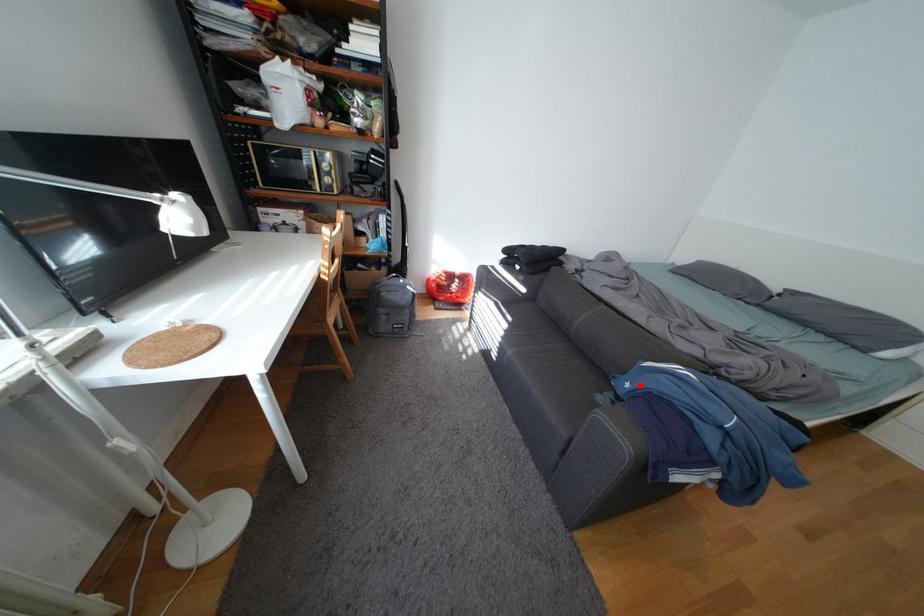
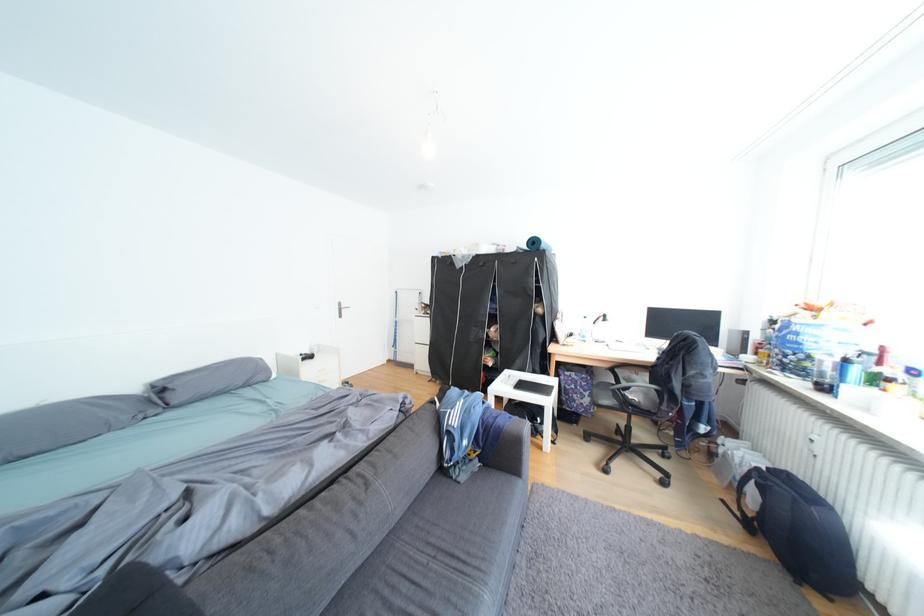
Question: A red point is marked in image1. In image2, is the corresponding 3D point closer to the camera or farther? Reply with the corresponding letter.

Choices:
 (A) The corresponding 3D point is closer.
 (B) The corresponding 3D point is farther.

Answer: (B)